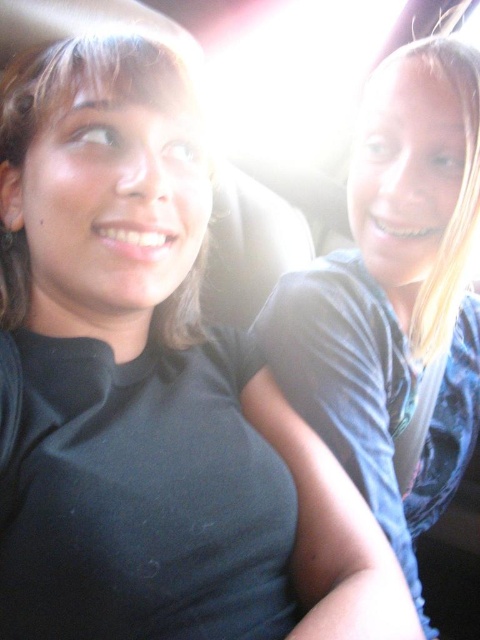
Does point (335, 308) come closer to viewer compared to point (190, 298)?

No, (335, 308) is further to viewer.

Does blue fabric shirt at right have a larger size compared to matte black hair at upper left?

Yes, blue fabric shirt at right is bigger than matte black hair at upper left.

Locate an element on the screen. The image size is (480, 640). blue fabric shirt at right is located at coordinates (395, 296).